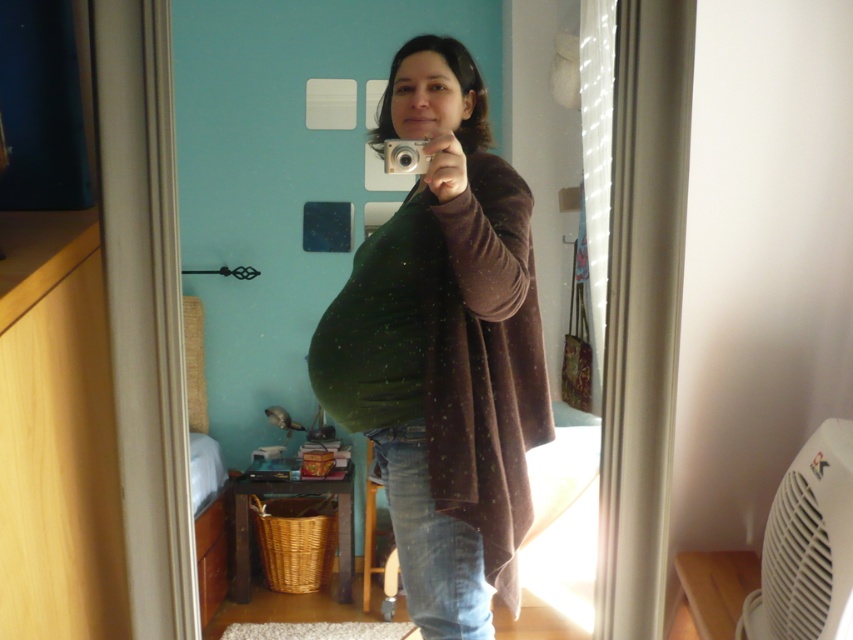
Question: Is green fabric pillow at center below green fuzzy blanket at center?

Choices:
 (A) no
 (B) yes

Answer: (A)

Question: Is green fabric pillow at center bigger than green fuzzy blanket at center?

Choices:
 (A) yes
 (B) no

Answer: (A)

Question: Does green fabric pillow at center appear over green fuzzy blanket at center?

Choices:
 (A) no
 (B) yes

Answer: (B)